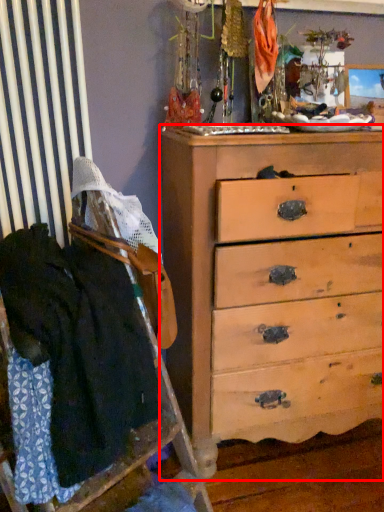
Question: In this image, where is chest of drawers (annotated by the red box) located relative to clothing?

Choices:
 (A) right
 (B) left

Answer: (A)